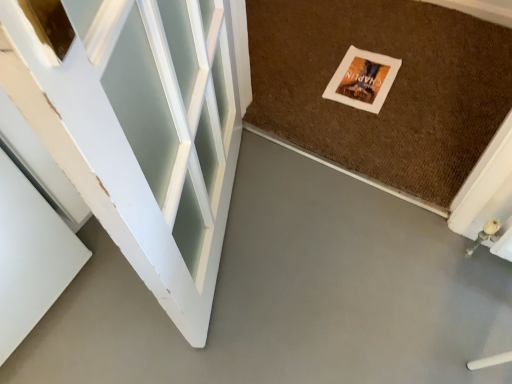
Question: Considering the relative positions of matte paper postcard at center and brown textured mat at center in the image provided, is matte paper postcard at center to the right of brown textured mat at center from the viewer's perspective?

Choices:
 (A) no
 (B) yes

Answer: (A)

Question: Is matte paper postcard at center facing towards brown textured mat at center?

Choices:
 (A) yes
 (B) no

Answer: (A)

Question: Does matte paper postcard at center have a greater width compared to brown textured mat at center?

Choices:
 (A) no
 (B) yes

Answer: (A)

Question: Are matte paper postcard at center and brown textured mat at center beside each other?

Choices:
 (A) yes
 (B) no

Answer: (B)

Question: From a real-world perspective, does matte paper postcard at center stand above brown textured mat at center?

Choices:
 (A) no
 (B) yes

Answer: (B)

Question: Considering the relative positions of brown textured mat at center and gray smooth concrete at center in the image provided, is brown textured mat at center to the left or to the right of gray smooth concrete at center?

Choices:
 (A) left
 (B) right

Answer: (B)

Question: Considering their positions, is brown textured mat at center located in front of or behind gray smooth concrete at center?

Choices:
 (A) behind
 (B) front

Answer: (A)

Question: From the image's perspective, is brown textured mat at center located above or below gray smooth concrete at center?

Choices:
 (A) below
 (B) above

Answer: (B)

Question: From their relative heights in the image, would you say brown textured mat at center is taller or shorter than gray smooth concrete at center?

Choices:
 (A) short
 (B) tall

Answer: (B)

Question: In the image, is matte paper postcard at center on the left side or the right side of gray smooth concrete at center?

Choices:
 (A) left
 (B) right

Answer: (B)

Question: Is matte paper postcard at center spatially inside gray smooth concrete at center, or outside of it?

Choices:
 (A) inside
 (B) outside

Answer: (B)

Question: In the image, is matte paper postcard at center positioned in front of or behind gray smooth concrete at center?

Choices:
 (A) front
 (B) behind

Answer: (B)

Question: From a real-world perspective, is matte paper postcard at center above or below gray smooth concrete at center?

Choices:
 (A) below
 (B) above

Answer: (B)

Question: Do you think brown textured mat at center is within matte paper postcard at center, or outside of it?

Choices:
 (A) outside
 (B) inside

Answer: (A)

Question: From a real-world perspective, is brown textured mat at center physically located above or below matte paper postcard at center?

Choices:
 (A) below
 (B) above

Answer: (A)